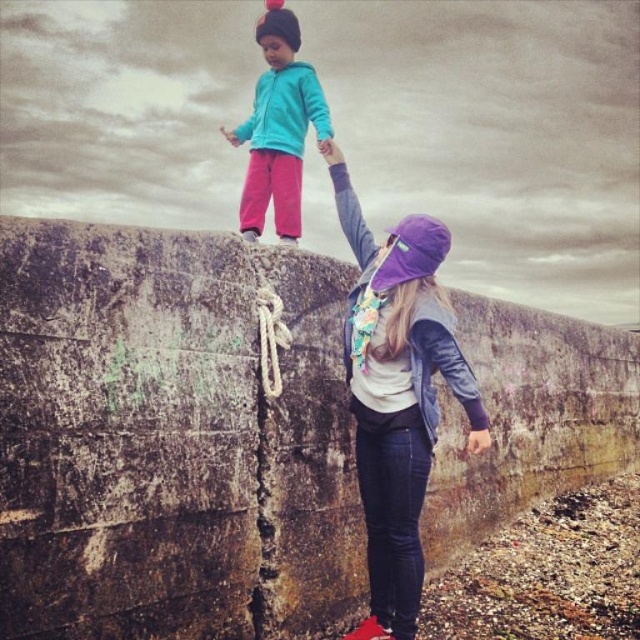
Is point (317, 273) farther from viewer compared to point (305, 97)?

No, it is not.

Is rusty concrete wall at upper center positioned at the back of turquoise fleece jacket at upper center?

No, it is not.

Identify the location of rusty concrete wall at upper center. The height and width of the screenshot is (640, 640). coord(170,440).

I want to click on rusty concrete wall at upper center, so click(170, 440).

Is purple fabric hat at upper center to the right of turquoise fleece jacket at upper center from the viewer's perspective?

Yes, purple fabric hat at upper center is to the right of turquoise fleece jacket at upper center.

Does purple fabric hat at upper center appear over turquoise fleece jacket at upper center?

No.

Which is in front, point (392, 444) or point (221, 131)?

Point (392, 444) is in front.

In order to click on purple fabric hat at upper center in this screenshot , I will do `click(397, 396)`.

Is purple fabric hat at upper center wider than white woven rope at center?

Indeed, purple fabric hat at upper center has a greater width compared to white woven rope at center.

Can you confirm if purple fabric hat at upper center is smaller than white woven rope at center?

No, purple fabric hat at upper center is not smaller than white woven rope at center.

Describe the element at coordinates (397, 396) in the screenshot. I see `purple fabric hat at upper center` at that location.

This screenshot has height=640, width=640. Find the location of `purple fabric hat at upper center`. purple fabric hat at upper center is located at coordinates (397, 396).